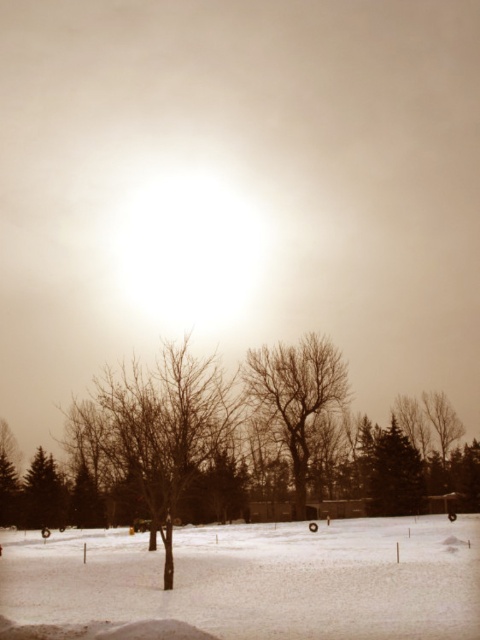
Can you confirm if bare branches at center is bigger than bare wood tree at center?

Correct, bare branches at center is larger in size than bare wood tree at center.

Measure the distance from bare branches at center to bare wood tree at center.

bare branches at center is 16.57 meters from bare wood tree at center.

Is point (127, 458) positioned before point (323, 360)?

Yes, it is.

Where is `bare branches at center`? bare branches at center is located at coordinates click(x=158, y=429).

Measure the distance from bare branches at center to green textured evergreen at center.

bare branches at center and green textured evergreen at center are 23.01 meters apart from each other.

In the scene shown: Measure the distance between point (228, 419) and camera.

Point (228, 419) is 25.97 meters from camera.

What are the coordinates of `bare branches at center` in the screenshot? It's located at (158, 429).

You are a GUI agent. You are given a task and a screenshot of the screen. Output one action in this format:
    pyautogui.click(x=<x>, y=<y>)
    Task: Click on the white powdery snow at center
    
    Given the screenshot: What is the action you would take?
    pyautogui.click(x=260, y=579)

Does white powdery snow at center have a greater width compared to green textured evergreen at center?

Indeed, white powdery snow at center has a greater width compared to green textured evergreen at center.

Is point (360, 586) behind point (372, 502)?

No.

Identify the location of white powdery snow at center. The width and height of the screenshot is (480, 640). (260, 579).